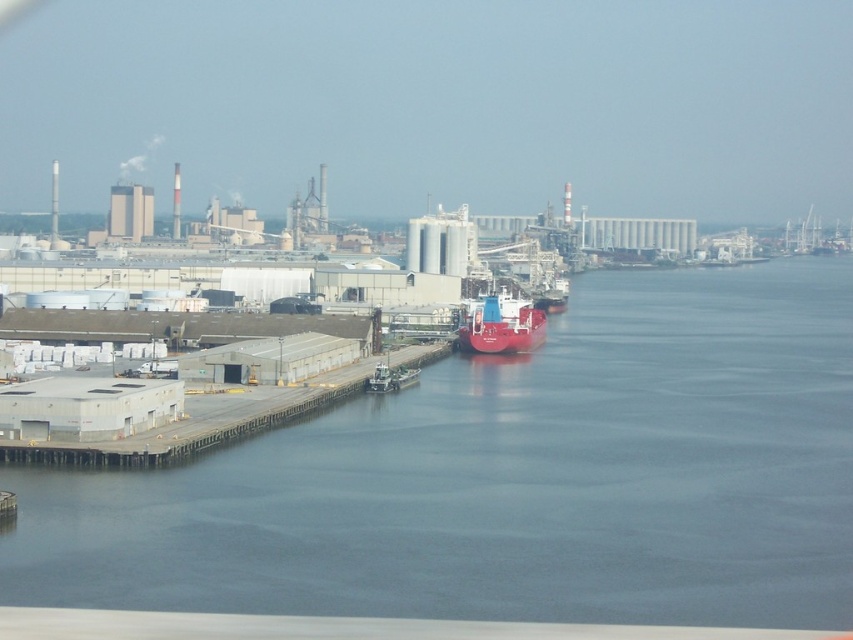
Can you confirm if blue water at center is taller than gray concrete dock at lower left?

Correct, blue water at center is much taller as gray concrete dock at lower left.

Which of these two, blue water at center or gray concrete dock at lower left, stands shorter?

With less height is gray concrete dock at lower left.

Locate an element on the screen. This screenshot has height=640, width=853. blue water at center is located at coordinates (514, 477).

Between point (674, 378) and point (512, 323), which one is positioned in front?

Point (674, 378) is more forward.

Is point (846, 392) more distant than point (518, 314)?

That is False.

Identify the location of blue water at center. The image size is (853, 640). (514, 477).

Does point (94, 451) come closer to viewer compared to point (502, 317)?

Yes, it is in front of point (502, 317).

Does gray concrete dock at lower left have a greater height compared to red matte ship at center?

Yes, gray concrete dock at lower left is taller than red matte ship at center.

You are a GUI agent. You are given a task and a screenshot of the screen. Output one action in this format:
    pyautogui.click(x=<x>, y=<y>)
    Task: Click on the gray concrete dock at lower left
    
    Given the screenshot: What is the action you would take?
    pyautogui.click(x=196, y=424)

At what (x,y) coordinates should I click in order to perform the action: click on gray concrete dock at lower left. Please return your answer as a coordinate pair (x, y). This screenshot has width=853, height=640. Looking at the image, I should click on (196, 424).